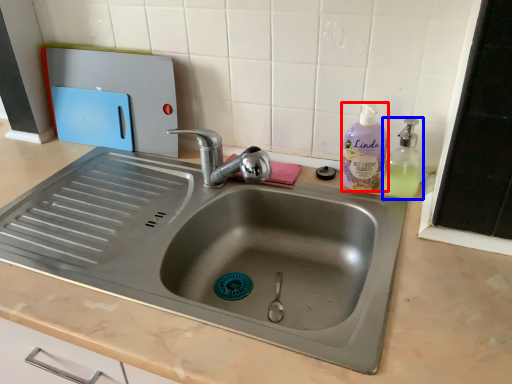
Question: Among these objects, which one is farthest to the camera, cleaning product (highlighted by a red box) or soap dispenser (highlighted by a blue box)?

Choices:
 (A) cleaning product
 (B) soap dispenser

Answer: (A)